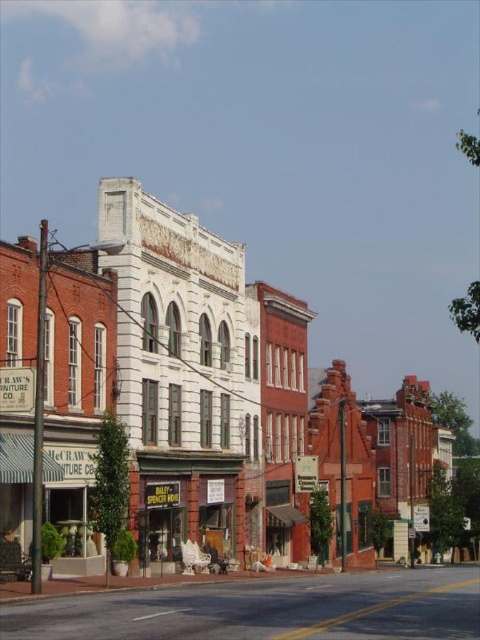
Question: Is white brick building at center wider than matte brown storefront at center?

Choices:
 (A) yes
 (B) no

Answer: (A)

Question: Which point is closer to the camera taking this photo?

Choices:
 (A) (255, 362)
 (B) (237, 492)

Answer: (B)

Question: Can you confirm if white brick building at center is bigger than matte brown storefront at center?

Choices:
 (A) no
 (B) yes

Answer: (B)

Question: Can you confirm if white brick building at center is positioned above matte brown storefront at center?

Choices:
 (A) no
 (B) yes

Answer: (B)

Question: Which of the following is the closest to the observer?

Choices:
 (A) (180, 515)
 (B) (85, 336)

Answer: (B)